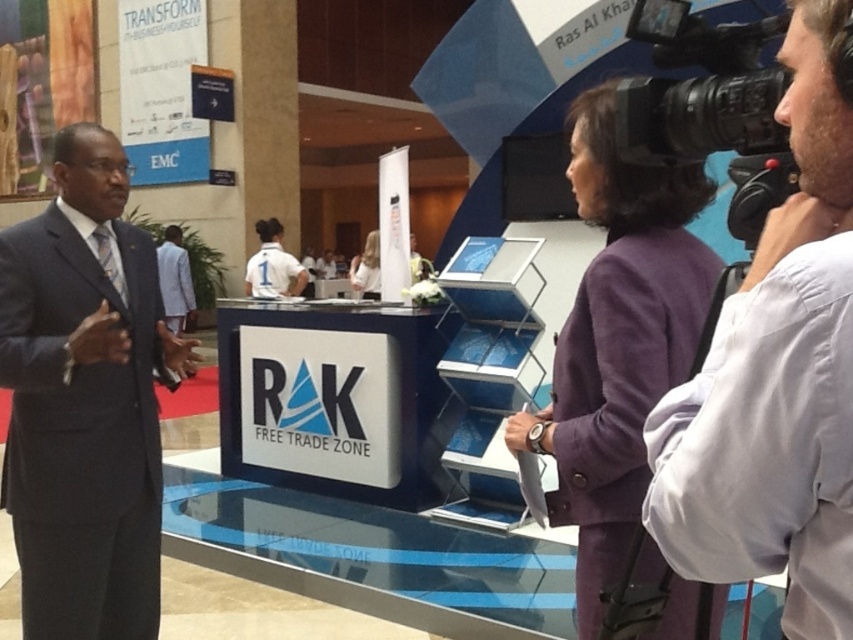
Question: Can you confirm if dark blue suit at left is positioned to the right of white jersey at center?

Choices:
 (A) no
 (B) yes

Answer: (B)

Question: Considering the real-world distances, which object is closest to the black plastic video camera at upper right?

Choices:
 (A) dark blue suit at left
 (B) white shirt at center

Answer: (B)

Question: Is black plastic video camera at upper right below white jersey at center?

Choices:
 (A) no
 (B) yes

Answer: (B)

Question: Among these objects, which one is nearest to the camera?

Choices:
 (A) black plastic video camera at upper right
 (B) white jersey at center

Answer: (A)

Question: Which point is closer to the camera?

Choices:
 (A) (718, 144)
 (B) (79, 275)

Answer: (A)

Question: Is white shirt at center above black plastic video camera at upper right?

Choices:
 (A) yes
 (B) no

Answer: (B)